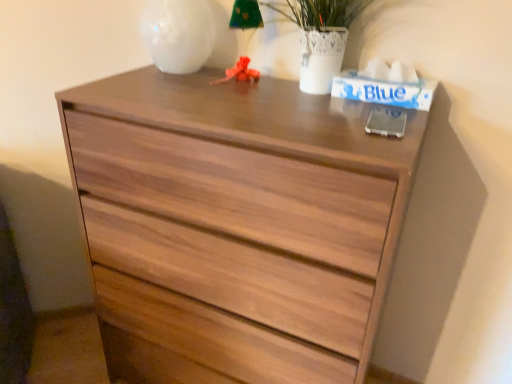
Image resolution: width=512 pixels, height=384 pixels. What do you see at coordinates (234, 226) in the screenshot?
I see `wooden chest of drawers at center` at bounding box center [234, 226].

Where is `wooden chest of drawers at center`? wooden chest of drawers at center is located at coordinates (234, 226).

The width and height of the screenshot is (512, 384). I want to click on matte white glass at upper center, so click(246, 40).

What do you see at coordinates (246, 40) in the screenshot? I see `matte white glass at upper center` at bounding box center [246, 40].

Image resolution: width=512 pixels, height=384 pixels. I want to click on wooden chest of drawers at center, so click(x=234, y=226).

Which is more to the right, matte white glass at upper center or wooden chest of drawers at center?

From the viewer's perspective, wooden chest of drawers at center appears more on the right side.

Is matte white glass at upper center closer to camera compared to wooden chest of drawers at center?

That is False.

Between point (248, 12) and point (100, 89), which one is positioned behind?

The point (248, 12) is farther from the camera.

From the image's perspective, which is below, matte white glass at upper center or wooden chest of drawers at center?

wooden chest of drawers at center appears lower in the image.

From a real-world perspective, who is located higher, matte white glass at upper center or wooden chest of drawers at center?

From a 3D spatial view, matte white glass at upper center is above.

Considering the relative sizes of matte white glass at upper center and wooden chest of drawers at center in the image provided, is matte white glass at upper center wider than wooden chest of drawers at center?

No.

Is matte white glass at upper center taller or shorter than wooden chest of drawers at center?

Clearly, matte white glass at upper center is shorter compared to wooden chest of drawers at center.

Who is bigger, matte white glass at upper center or wooden chest of drawers at center?

wooden chest of drawers at center.

Looking at this image, would you say wooden chest of drawers at center is part of matte white glass at upper center's contents?

No, matte white glass at upper center does not contain wooden chest of drawers at center.

Is matte white glass at upper center touching wooden chest of drawers at center?

matte white glass at upper center and wooden chest of drawers at center are not in contact.

Is matte white glass at upper center turned away from wooden chest of drawers at center?

No, wooden chest of drawers at center is not at the back of matte white glass at upper center.

The image size is (512, 384). Identify the location of table lamp above the wooden chest of drawers at center (from the image's perspective). (246, 40).

Consider the image. Considering the relative positions of wooden chest of drawers at center and matte white glass at upper center in the image provided, is wooden chest of drawers at center to the left of matte white glass at upper center from the viewer's perspective?

In fact, wooden chest of drawers at center is to the right of matte white glass at upper center.

Between wooden chest of drawers at center and matte white glass at upper center, which one is positioned in front?

Positioned in front is wooden chest of drawers at center.

Is point (174, 129) closer or farther from the camera than point (241, 78)?

Clearly, point (174, 129) is closer to the camera than point (241, 78).

In the scene shown: From the image's perspective, is wooden chest of drawers at center above matte white glass at upper center?

No.

From a real-world perspective, is wooden chest of drawers at center on top of matte white glass at upper center?

Actually, wooden chest of drawers at center is physically below matte white glass at upper center in the real world.

Considering the sizes of wooden chest of drawers at center and matte white glass at upper center in the image, is wooden chest of drawers at center wider or thinner than matte white glass at upper center?

In the image, wooden chest of drawers at center appears to be wider than matte white glass at upper center.

Can you confirm if wooden chest of drawers at center is taller than matte white glass at upper center?

Yes, wooden chest of drawers at center is taller than matte white glass at upper center.

Is wooden chest of drawers at center bigger or smaller than matte white glass at upper center?

In the image, wooden chest of drawers at center appears to be larger than matte white glass at upper center.

Is wooden chest of drawers at center spatially inside matte white glass at upper center, or outside of it?

wooden chest of drawers at center cannot be found inside matte white glass at upper center.

Is wooden chest of drawers at center not near matte white glass at upper center?

They are positioned close to each other.

Does wooden chest of drawers at center turn towards matte white glass at upper center?

No, wooden chest of drawers at center is not aimed at matte white glass at upper center.

How many degrees apart are the facing directions of wooden chest of drawers at center and matte white glass at upper center?

3.88 degrees separate the facing orientations of wooden chest of drawers at center and matte white glass at upper center.

This screenshot has height=384, width=512. Identify the location of table lamp on the left of wooden chest of drawers at center. (246, 40).

Find the location of a particular element. Image resolution: width=512 pixels, height=384 pixels. table lamp above the wooden chest of drawers at center (from a real-world perspective) is located at coordinates (246, 40).

Find the location of a particular element. The height and width of the screenshot is (384, 512). the chest of drawers located underneath the matte white glass at upper center (from a real-world perspective) is located at coordinates click(x=234, y=226).